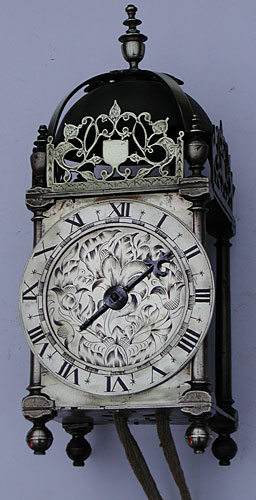
Locate an element on the screen. clock minute hand is located at coordinates pos(136,281).